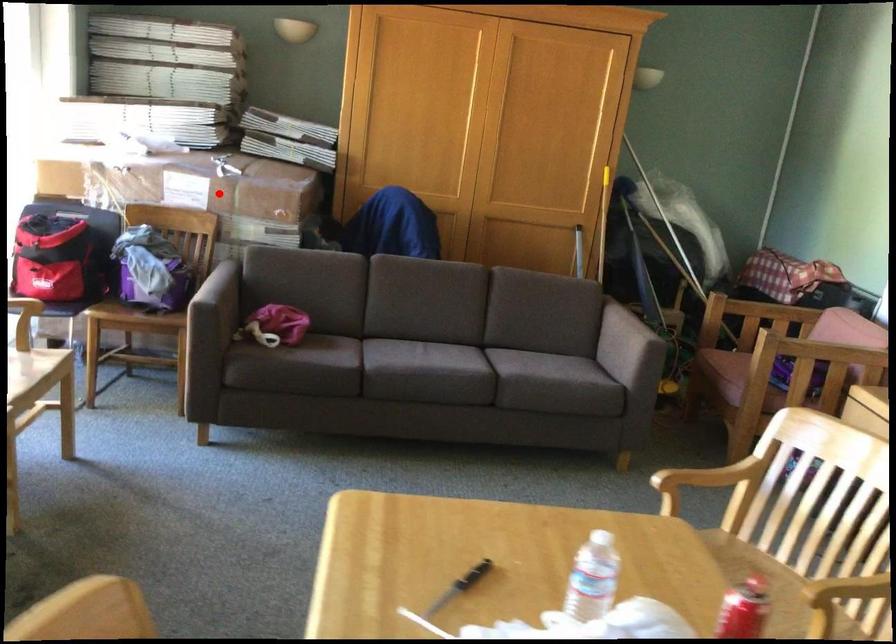
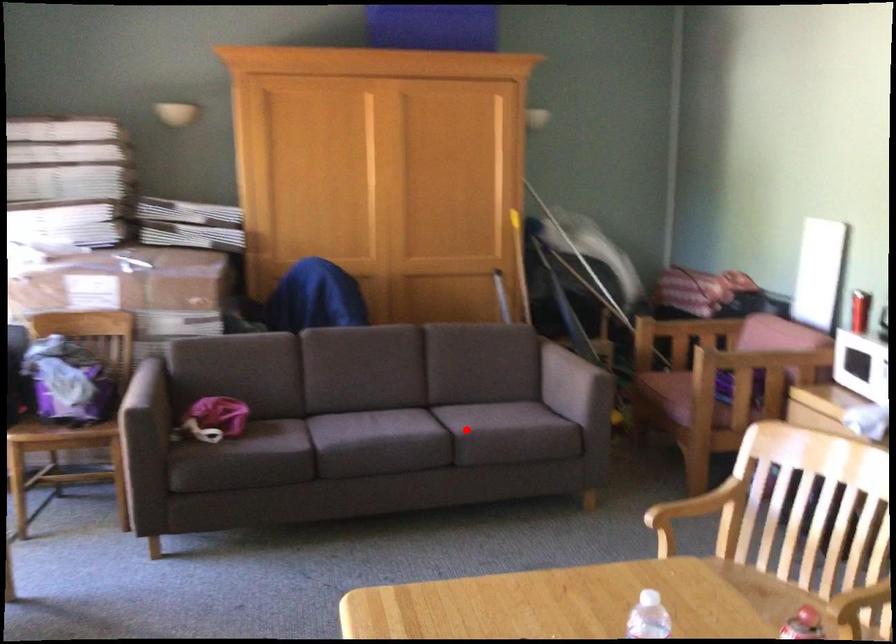
I am providing you with two images of the same scene from different viewpoints. A red point is marked on the first image and another point is marked on the second image. Is the red point in image1 aligned with the point shown in image2?

No